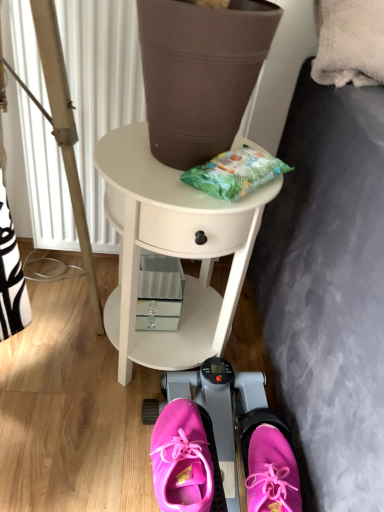
You are a GUI agent. You are given a task and a screenshot of the screen. Output one action in this format:
    pyautogui.click(x=<x>, y=<y>)
    Task: Click on the vacant space to the left of white glossy side table at center
    The height and width of the screenshot is (512, 384).
    Given the screenshot: What is the action you would take?
    pyautogui.click(x=53, y=359)